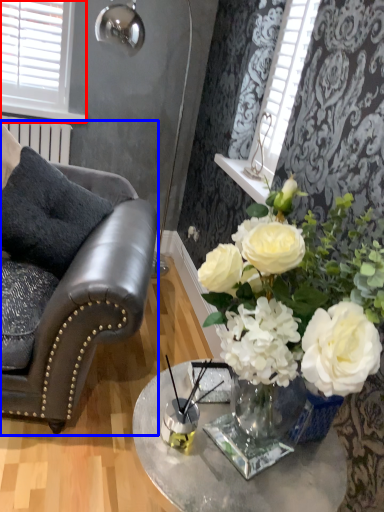
Question: Which object appears closest to the camera in this image, window (highlighted by a red box) or chair (highlighted by a blue box)?

Choices:
 (A) window
 (B) chair

Answer: (B)